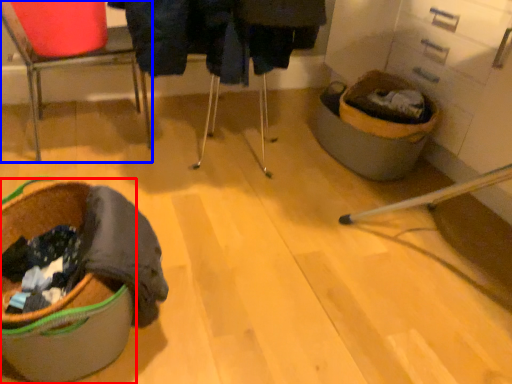
Question: Which point is closer to the camera, laundry basket (highlighted by a red box) or chair (highlighted by a blue box)?

Choices:
 (A) laundry basket
 (B) chair

Answer: (A)